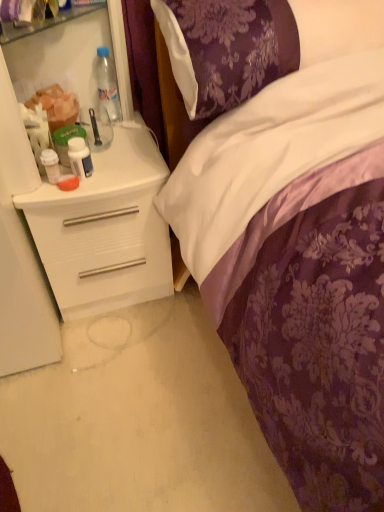
Question: Does white plastic cup at left, which is the 1th bottle in left-to-right order, touch white glossy pill bottle at left, which is the 2th bottle from top to bottom?

Choices:
 (A) no
 (B) yes

Answer: (B)

Question: From the image's perspective, is white plastic cup at left, positioned as the third bottle in top-to-bottom order, located beneath white glossy pill bottle at left, the 2th bottle when ordered from bottom to top?

Choices:
 (A) yes
 (B) no

Answer: (A)

Question: From a real-world perspective, is white plastic cup at left, the first bottle ordered from the bottom, under white glossy pill bottle at left, the 2th bottle when ordered from back to front?

Choices:
 (A) yes
 (B) no

Answer: (A)

Question: Would you say white plastic cup at left, the first bottle ordered from the bottom, is outside white glossy pill bottle at left, which is counted as the second bottle, starting from the right?

Choices:
 (A) no
 (B) yes

Answer: (B)

Question: Is white plastic cup at left, positioned as the first bottle in front-to-back order, closer to camera compared to white glossy pill bottle at left, the second bottle in the left-to-right sequence?

Choices:
 (A) yes
 (B) no

Answer: (A)

Question: Is point (56, 103) closer or farther from the camera than point (110, 94)?

Choices:
 (A) farther
 (B) closer

Answer: (B)

Question: In the image, is translucent plastic cup at left positioned in front of or behind clear plastic bottle at upper left, the 3th bottle from the left?

Choices:
 (A) front
 (B) behind

Answer: (A)

Question: Based on their positions, is translucent plastic cup at left located to the left or right of clear plastic bottle at upper left, the 1th bottle viewed from the back?

Choices:
 (A) left
 (B) right

Answer: (A)

Question: From the image's perspective, is translucent plastic cup at left located above or below clear plastic bottle at upper left, which appears as the third bottle when ordered from the bottom?

Choices:
 (A) above
 (B) below

Answer: (B)

Question: From a real-world perspective, is white glossy pill bottle at left, which is the 2th bottle from top to bottom, positioned above or below translucent plastic cup at left?

Choices:
 (A) below
 (B) above

Answer: (A)

Question: Considering the positions of point (67, 148) and point (41, 92), is point (67, 148) closer or farther from the camera than point (41, 92)?

Choices:
 (A) farther
 (B) closer

Answer: (B)

Question: Choose the correct answer: Is white glossy pill bottle at left, the 2th bottle when ordered from back to front, inside translucent plastic cup at left or outside it?

Choices:
 (A) inside
 (B) outside

Answer: (B)

Question: Visually, is white glossy pill bottle at left, the second bottle in the front-to-back sequence, positioned to the left or to the right of translucent plastic cup at left?

Choices:
 (A) right
 (B) left

Answer: (A)

Question: From their relative heights in the image, would you say white glossy pill bottle at left, which is counted as the second bottle, starting from the right, is taller or shorter than clear plastic bottle at upper left, the 3th bottle from the left?

Choices:
 (A) tall
 (B) short

Answer: (B)

Question: Is white glossy pill bottle at left, the second bottle in the left-to-right sequence, bigger or smaller than clear plastic bottle at upper left, the 1th bottle viewed from the back?

Choices:
 (A) small
 (B) big

Answer: (A)